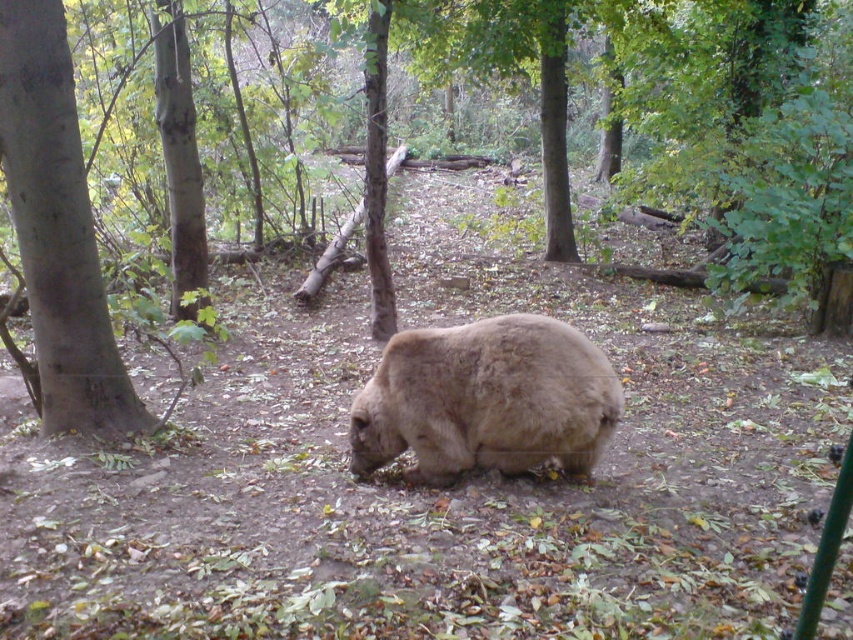
You are a hiker who wants to take a photo of the fuzzy brown bear at center and the brown rough tree at left. Which object is shorter in the scene?

The fuzzy brown bear at center is shorter than the brown rough tree at left.